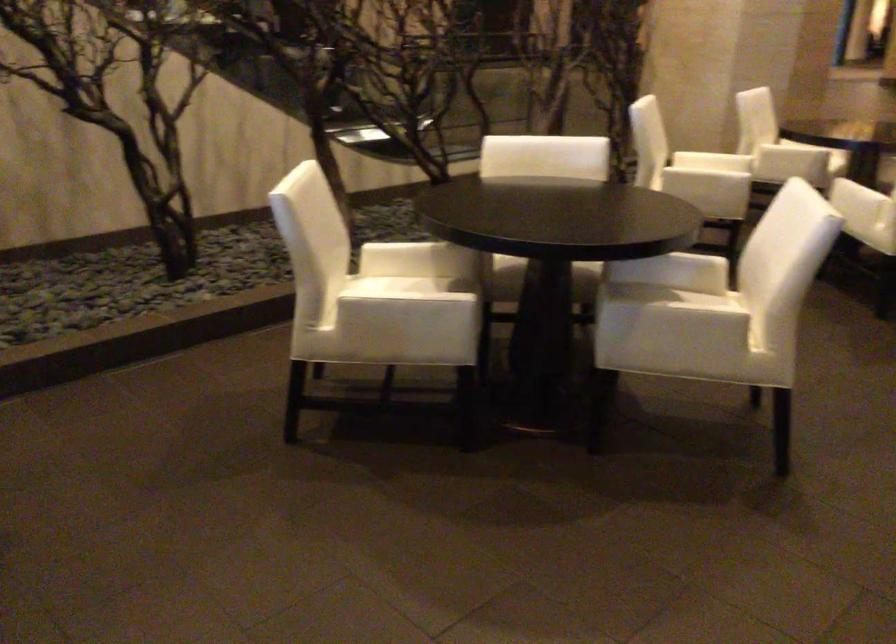
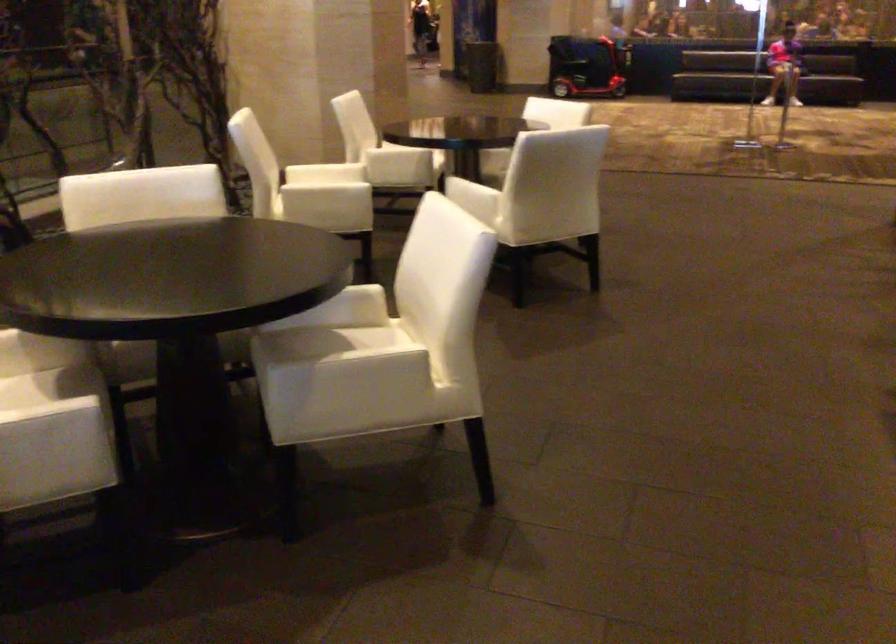
Locate, in the second image, the point that corresponds to pixel 442 285 in the first image.

(46, 383)